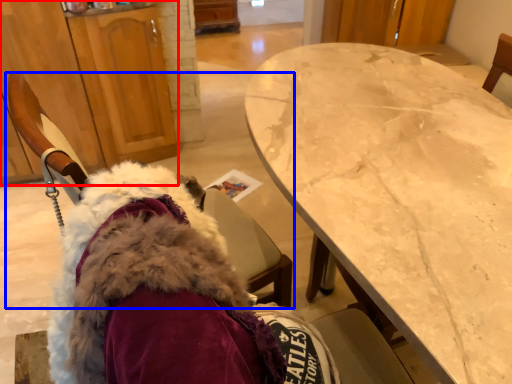
Question: Which of the following is the closest to the observer, cabinetry (highlighted by a red box) or chair (highlighted by a blue box)?

Choices:
 (A) cabinetry
 (B) chair

Answer: (B)